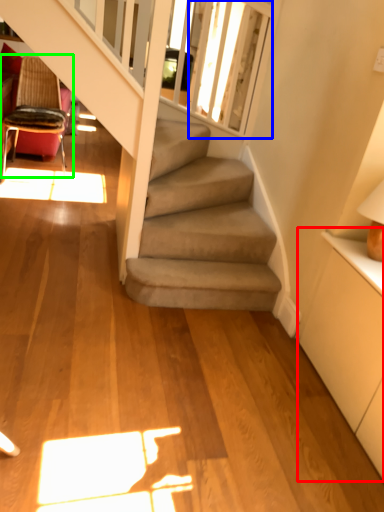
Question: Based on their relative distances, which object is farther from dresser (highlighted by a red box)? Choose from window screen (highlighted by a blue box) and chair (highlighted by a green box).

Choices:
 (A) window screen
 (B) chair

Answer: (B)